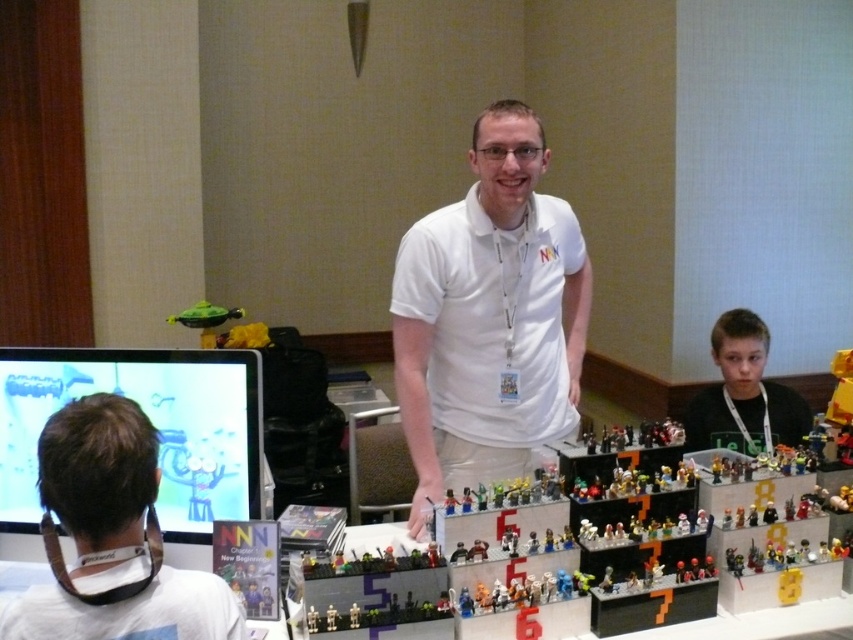
Question: Is white matte shirt at center to the right of smooth black shirt at lower right from the viewer's perspective?

Choices:
 (A) yes
 (B) no

Answer: (B)

Question: Which point appears closest to the camera in this image?

Choices:
 (A) (247, 406)
 (B) (752, 403)
 (C) (543, 416)

Answer: (A)

Question: Among these objects, which one is nearest to the camera?

Choices:
 (A) smooth black shirt at lower right
 (B) matte plastic monitor at left

Answer: (B)

Question: Does matte plastic monitor at left appear over smooth black shirt at lower right?

Choices:
 (A) yes
 (B) no

Answer: (B)

Question: Which is farther from the smooth black shirt at lower right?

Choices:
 (A) white matte shirt at center
 (B) matte plastic monitor at left

Answer: (B)

Question: Does white matte shirt at center appear over smooth black shirt at lower right?

Choices:
 (A) no
 (B) yes

Answer: (B)